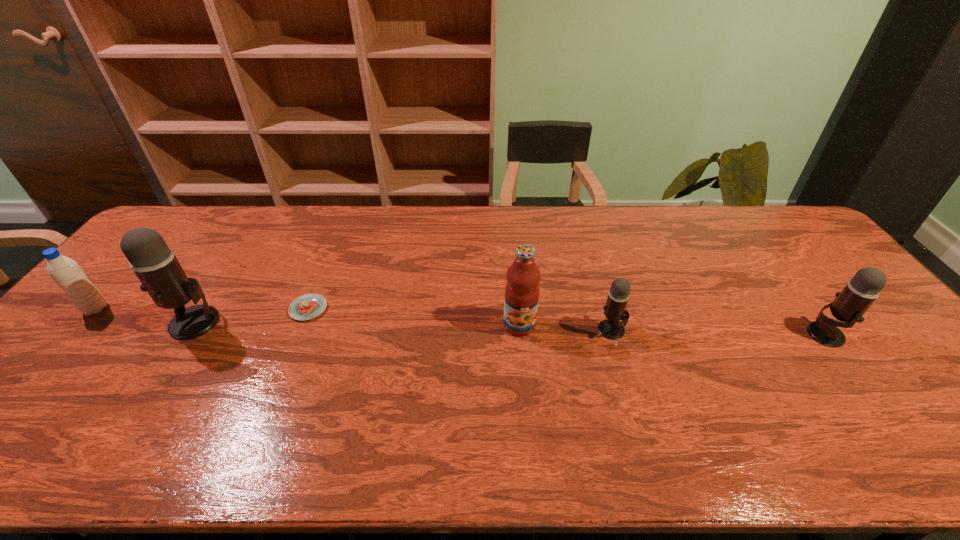
To make them evenly spaced by inserting another microphone among them, please locate a free space for this new microphone. Please provide its 2D coordinates. Your answer should be formatted as a tuple, i.e. [(x, y)], where the tuple contains the x and y coordinates of a point satisfying the conditions above.

[(401, 326)]